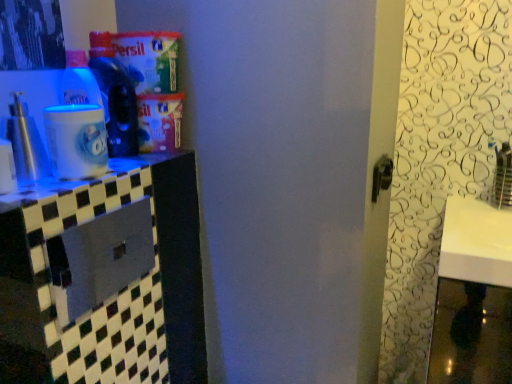
This screenshot has height=384, width=512. What are the coordinates of `spots to the right of metallic silver spray at left, the first bottle when ordered from front to back` in the screenshot? It's located at (86, 173).